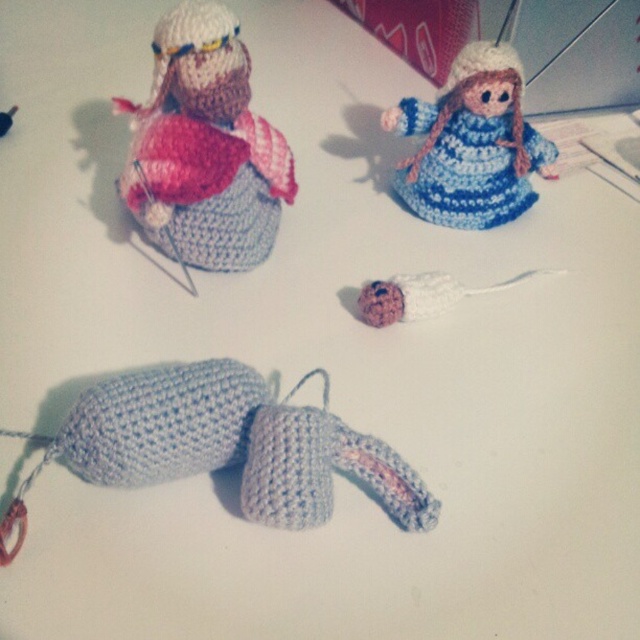
Question: Which point appears farthest from the camera in this image?

Choices:
 (A) (166, 28)
 (B) (317, 428)

Answer: (A)

Question: Does light blue yarn toy at center appear on the right side of pink yarn ball at center?

Choices:
 (A) no
 (B) yes

Answer: (A)

Question: Is matte pink yarn doll at upper left to the right of blue yarn doll at upper center from the viewer's perspective?

Choices:
 (A) no
 (B) yes

Answer: (A)

Question: Is light blue yarn toy at center further to the viewer compared to pink yarn ball at center?

Choices:
 (A) no
 (B) yes

Answer: (A)

Question: Which object is the closest to the blue yarn doll at upper center?

Choices:
 (A) pink yarn ball at center
 (B) light blue yarn toy at center

Answer: (A)

Question: Estimate the real-world distances between objects in this image. Which object is farther from the light blue yarn toy at center?

Choices:
 (A) pink yarn ball at center
 (B) matte pink yarn doll at upper left

Answer: (A)